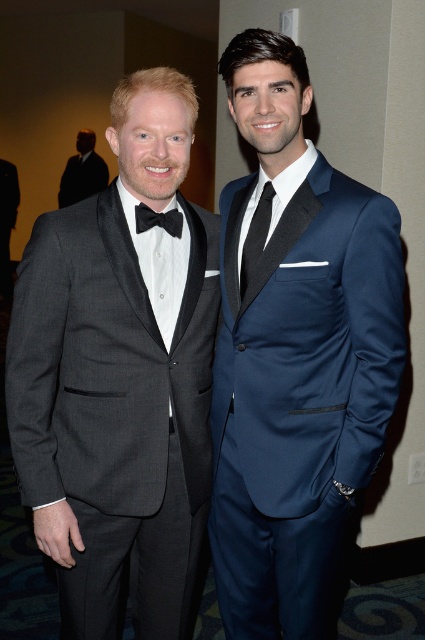
You are a photographer at a wedding reception. You need to position two guests for a photo. The guests are wearing the navy blue suit at center and the black satin bow tie at left. Based on their current positions, which guest is standing to the right of the other?

The navy blue suit at center is to the right of the black satin bow tie at left.

What are the coordinates of the black satin tie at center?

The black satin tie at center is located at coordinates point (255, 236).

You are a photographer trying to place a decorative ribbon exactly at the point with coordinates point [295,356]. Based on the scene described, where will the ribbon be placed?

The point [295,356] is on the navy blue suit at center, so the ribbon will be placed on the navy blue suit at center.